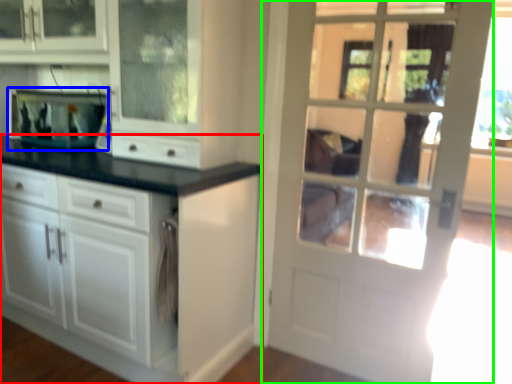
Question: Estimate the real-world distances between objects in this image. Which object is farther from cabinetry (highlighted by a red box), appliance (highlighted by a blue box) or door (highlighted by a green box)?

Choices:
 (A) appliance
 (B) door

Answer: (A)